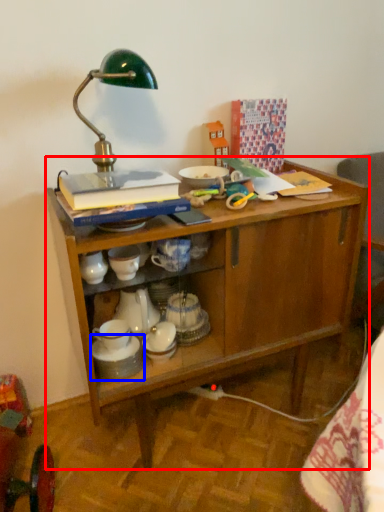
Question: Which of the following is the closest to the observer, desk (highlighted by a red box) or tableware (highlighted by a blue box)?

Choices:
 (A) desk
 (B) tableware

Answer: (A)